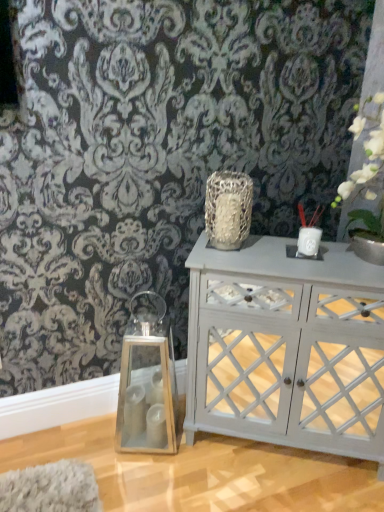
Image resolution: width=384 pixels, height=512 pixels. What are the coordinates of `vacant space in front of white ceramic candle holder at upper right, which ranks as the second candle holder in top-to-bottom order` in the screenshot? It's located at (315, 270).